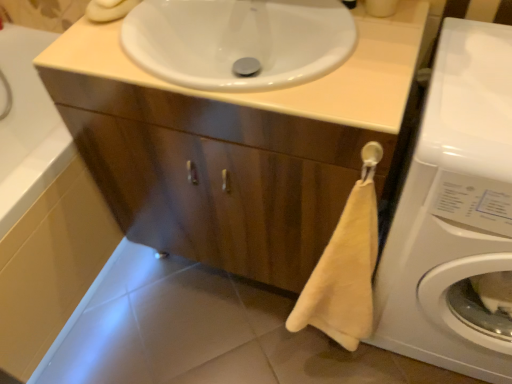
The image size is (512, 384). I want to click on empty space that is ontop of wooden cabinet at center (from a real-world perspective), so click(x=266, y=15).